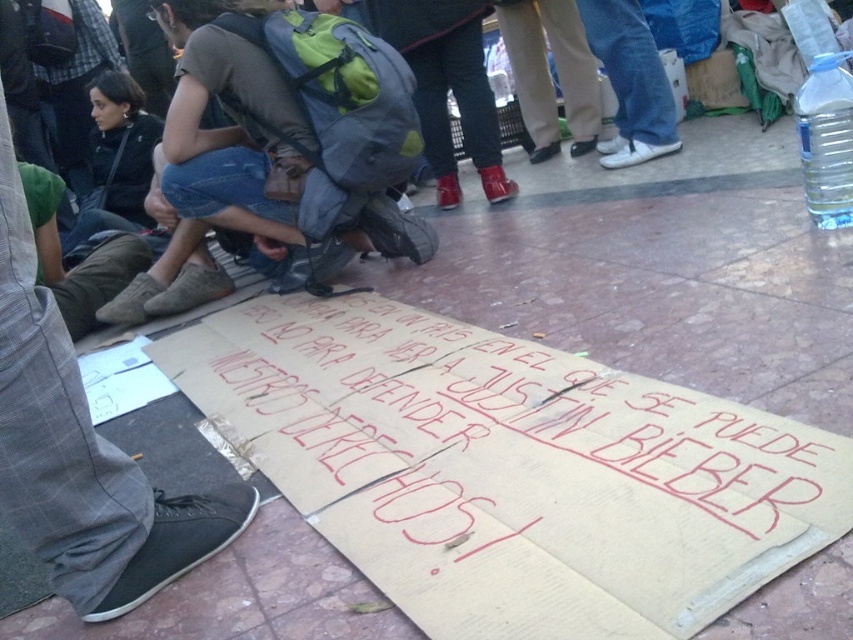
Does dark gray pants at lower left appear under clear plastic bottle at upper right?

Yes.

The height and width of the screenshot is (640, 853). What do you see at coordinates (82, 452) in the screenshot? I see `dark gray pants at lower left` at bounding box center [82, 452].

Locate an element on the screen. dark gray pants at lower left is located at coordinates (82, 452).

Which is above, cardboard sign at lower center or gray fabric backpack at center?

Positioned higher is gray fabric backpack at center.

Measure the distance from cardboard sign at lower center to gray fabric backpack at center.

They are 24.66 inches apart.

Between point (399, 515) and point (421, 262), which one is positioned in front?

Point (399, 515) is in front.

At what (x,y) coordinates should I click in order to perform the action: click on cardboard sign at lower center. Please return your answer as a coordinate pair (x, y). This screenshot has height=640, width=853. Looking at the image, I should click on (514, 458).

Is gray fabric backpack at center wider than dark gray pants at lower left?

Correct, the width of gray fabric backpack at center exceeds that of dark gray pants at lower left.

Does gray fabric backpack at center have a lesser height compared to dark gray pants at lower left?

No.

Which is in front, point (184, 90) or point (47, 509)?

Point (47, 509) is more forward.

Find the location of a particular element. The width and height of the screenshot is (853, 640). gray fabric backpack at center is located at coordinates (289, 129).